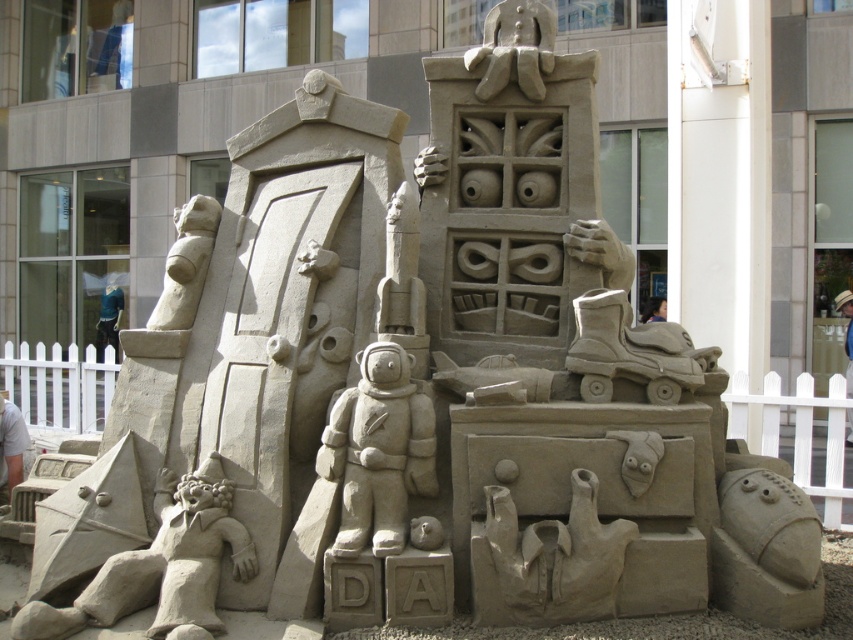
Is smooth sand hands at center shorter than smooth beige statue at upper left?

Indeed, smooth sand hands at center has a lesser height compared to smooth beige statue at upper left.

Can you confirm if smooth sand hands at center is smaller than smooth beige statue at upper left?

No.

Is point (508, 513) positioned in front of point (198, 273)?

Yes.

Find the location of a particular element. smooth sand hands at center is located at coordinates (547, 561).

Is smooth beige astronaut at center below smooth skin face at upper right?

Indeed, smooth beige astronaut at center is positioned under smooth skin face at upper right.

Is smooth beige astronaut at center positioned at the back of smooth skin face at upper right?

No.

Which is behind, point (355, 508) or point (659, 298)?

The point (659, 298) is behind.

Where is `smooth beige astronaut at center`? The height and width of the screenshot is (640, 853). smooth beige astronaut at center is located at coordinates (378, 451).

Based on the photo, between smooth white person at center and smooth skin face at upper right, which one is positioned higher?

smooth skin face at upper right is higher up.

At what (x,y) coordinates should I click in order to perform the action: click on smooth white person at center. Please return your answer as a coordinate pair (x, y). The image size is (853, 640). Looking at the image, I should click on (846, 332).